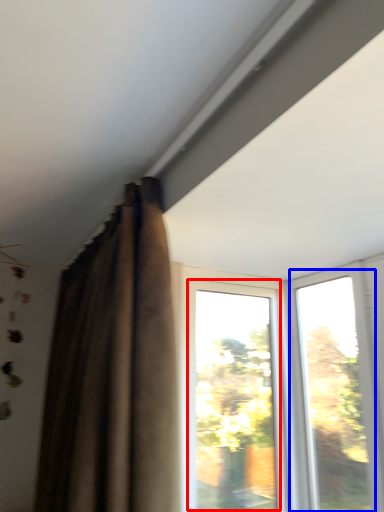
Question: Which point is further to the camera, window (highlighted by a red box) or window (highlighted by a blue box)?

Choices:
 (A) window
 (B) window

Answer: (A)